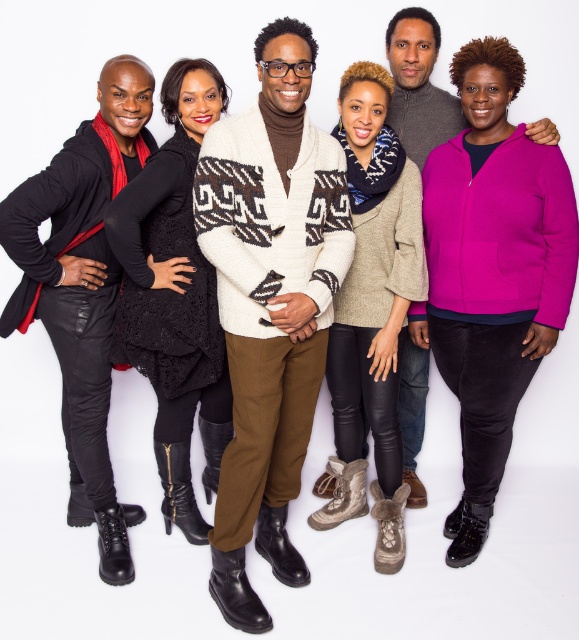
You are standing in front of a group photo of six people. You want to know if you can reach out and touch the white wool sweater at center without moving your position. The average human arm length is 0.7 meters. Can you do it?

The white wool sweater at center is 1.77 meters away from you. Since the average human arm length is 0.7 meters, you cannot reach it without moving closer.